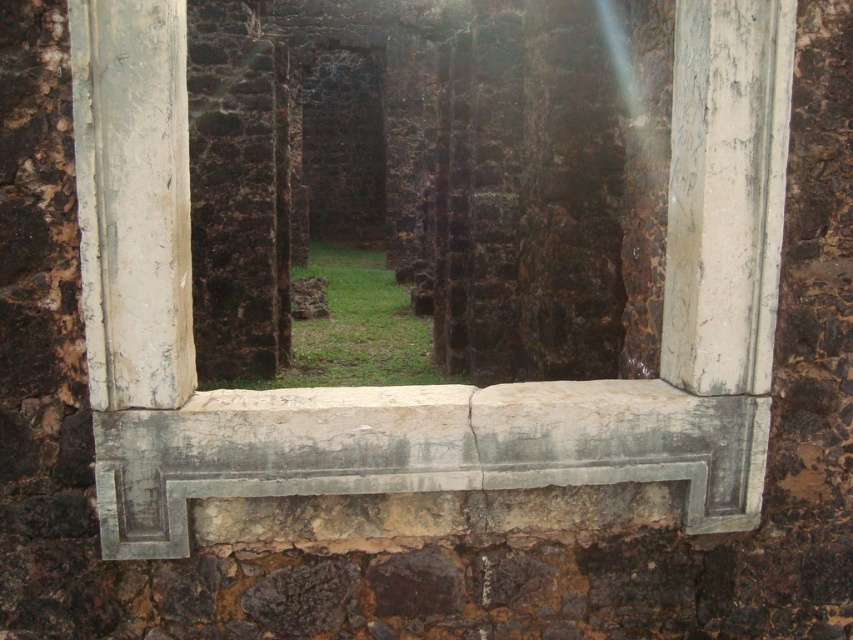
What do you see at coordinates (428, 385) in the screenshot? The height and width of the screenshot is (640, 853). I see `white weathered wood at center` at bounding box center [428, 385].

Who is more forward, (183, 360) or (434, 426)?

Point (183, 360) is more forward.

Who is more distant from viewer, (140, 420) or (335, 468)?

Point (335, 468)

The image size is (853, 640). Find the location of `white weathered wood at center`. white weathered wood at center is located at coordinates (428, 385).